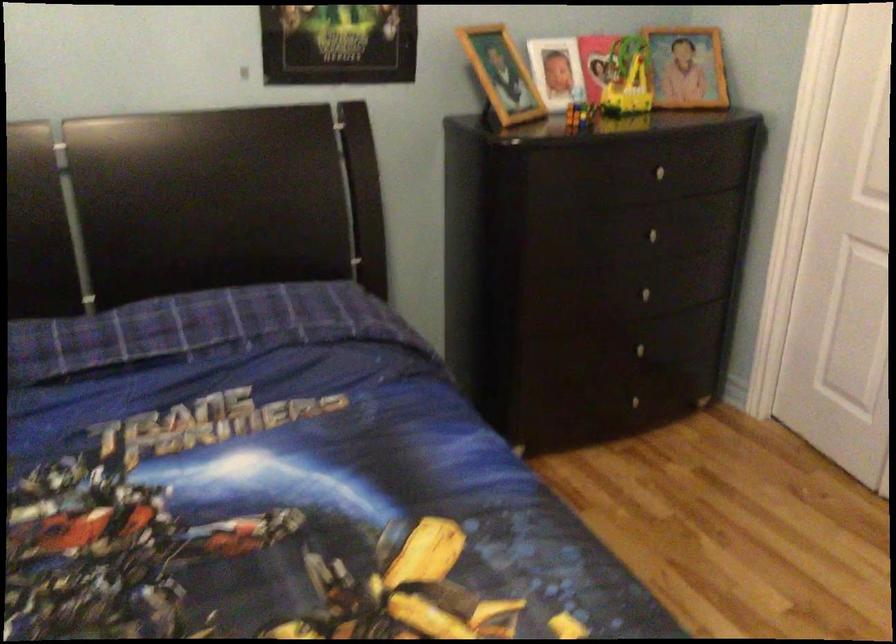
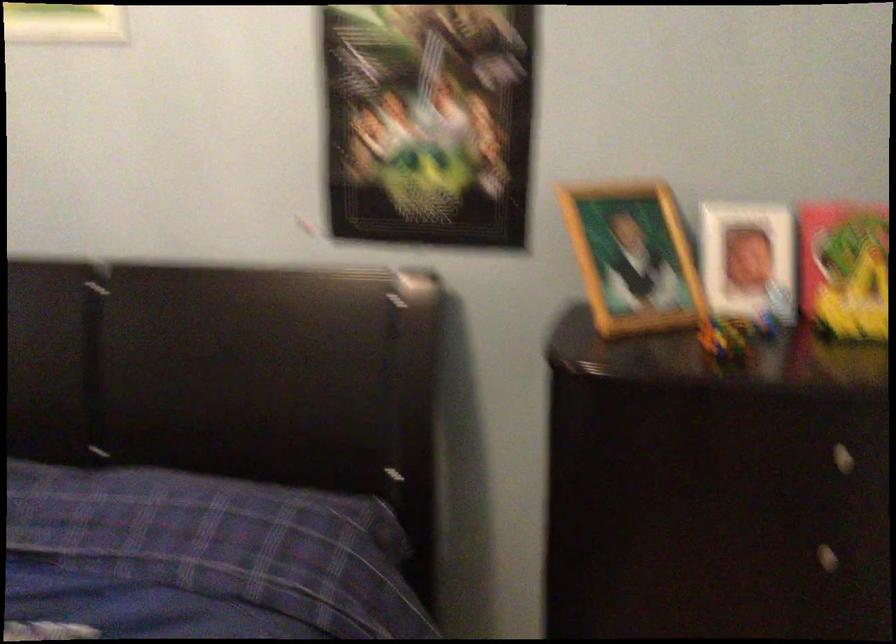
Locate, in the second image, the point that corresponds to pixel 503 73 in the first image.

(633, 258)